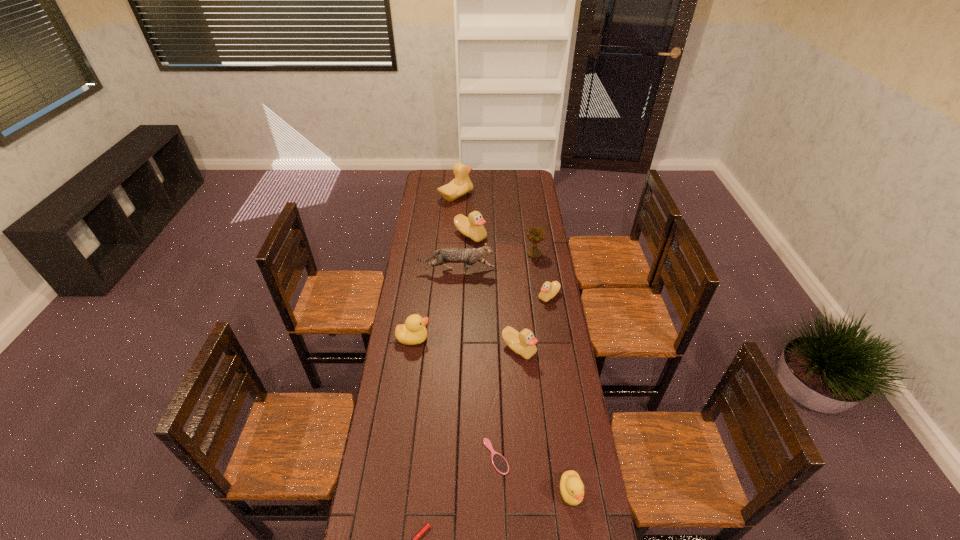
In order to click on vacant space located 0.300m on the front of the red chalice in this screenshot , I will do `click(540, 302)`.

Locate an element on the screen. vacant region located 0.070m at the beak of the third beige duck from left to right is located at coordinates (521, 377).

Find the location of `free region located 0.250m at the beak of the farther yellow duck`. free region located 0.250m at the beak of the farther yellow duck is located at coordinates (489, 338).

Where is `vacant region located at the beak of the fifth farthest object`? vacant region located at the beak of the fifth farthest object is located at coordinates (506, 296).

The image size is (960, 540). What are the coordinates of `free space located 0.400m at the beak of the fifth farthest object` in the screenshot? It's located at (452, 296).

You are a GUI agent. You are given a task and a screenshot of the screen. Output one action in this format:
    pyautogui.click(x=<x>, y=<y>)
    Task: Click on the free spot located at the beak of the fifth farthest object
    
    Given the screenshot: What is the action you would take?
    pyautogui.click(x=482, y=296)

You are a GUI agent. You are given a task and a screenshot of the screen. Output one action in this format:
    pyautogui.click(x=<x>, y=<y>)
    Task: Click on the free space located on the back of the third nearest object
    The image size is (960, 540).
    Given the screenshot: What is the action you would take?
    pyautogui.click(x=494, y=394)

Where is `object situated at the far edge`? object situated at the far edge is located at coordinates (461, 184).

What are the coordinates of `cat located at the left edge` in the screenshot? It's located at (445, 255).

Identify the location of chalice at the right edge. The width and height of the screenshot is (960, 540). (535, 234).